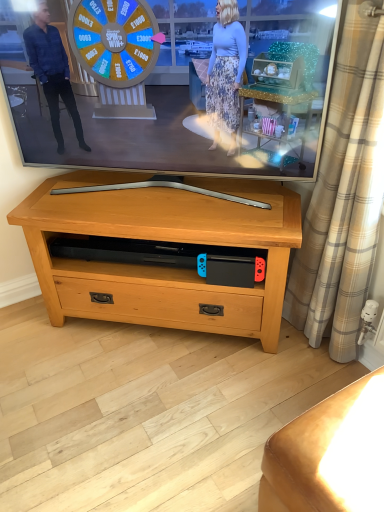
Question: Is beige plaid curtain at right looking in the opposite direction of pine wood tv stand at center?

Choices:
 (A) no
 (B) yes

Answer: (A)

Question: Is pine wood tv stand at center inside beige plaid curtain at right?

Choices:
 (A) yes
 (B) no

Answer: (B)

Question: From a real-world perspective, is beige plaid curtain at right located beneath pine wood tv stand at center?

Choices:
 (A) yes
 (B) no

Answer: (B)

Question: Can you confirm if beige plaid curtain at right is smaller than pine wood tv stand at center?

Choices:
 (A) yes
 (B) no

Answer: (A)

Question: From the image's perspective, is beige plaid curtain at right on top of pine wood tv stand at center?

Choices:
 (A) yes
 (B) no

Answer: (A)

Question: Considering the relative sizes of beige plaid curtain at right and pine wood tv stand at center in the image provided, is beige plaid curtain at right thinner than pine wood tv stand at center?

Choices:
 (A) no
 (B) yes

Answer: (B)

Question: Considering the relative positions of pine wood tv stand at center and matte black tv at center in the image provided, is pine wood tv stand at center to the right of matte black tv at center from the viewer's perspective?

Choices:
 (A) no
 (B) yes

Answer: (B)

Question: From the image's perspective, is pine wood tv stand at center on matte black tv at center?

Choices:
 (A) no
 (B) yes

Answer: (A)

Question: Is pine wood tv stand at center looking in the opposite direction of matte black tv at center?

Choices:
 (A) no
 (B) yes

Answer: (A)

Question: Considering the relative sizes of pine wood tv stand at center and matte black tv at center in the image provided, is pine wood tv stand at center shorter than matte black tv at center?

Choices:
 (A) no
 (B) yes

Answer: (B)

Question: Are pine wood tv stand at center and matte black tv at center located far from each other?

Choices:
 (A) yes
 (B) no

Answer: (B)

Question: Can you confirm if pine wood tv stand at center is thinner than matte black tv at center?

Choices:
 (A) no
 (B) yes

Answer: (A)

Question: Is beige plaid curtain at right taller than matte black tv at center?

Choices:
 (A) no
 (B) yes

Answer: (B)